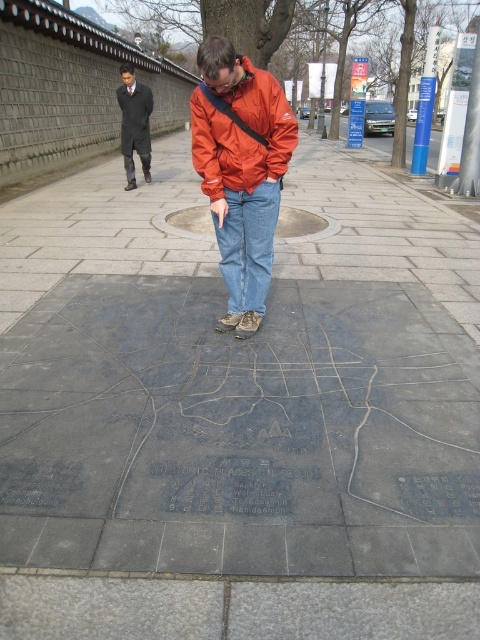
You are standing at the engraved map in the scene and want to find the nearest landmark shown on the map. The orange nylon jacket at center is positioned at coordinates 0.267, 0.502. Based on the jacket location, can you determine if the jacket is closer to the northern or southern end of the map?

The orange nylon jacket at center is located at point (240, 170). Since the y coordinate is 0.502, which is just above the midpoint of the map, it is slightly closer to the northern end of the map.

You are a tailor who needs to create a new jacket for a customer. You observe the orange nylon jacket at center and the dark gray coat at upper left in the scene. Which jacket would require more fabric to make, and why?

The orange nylon jacket at center would require more fabric because its width is larger than the dark gray coat at upper left.